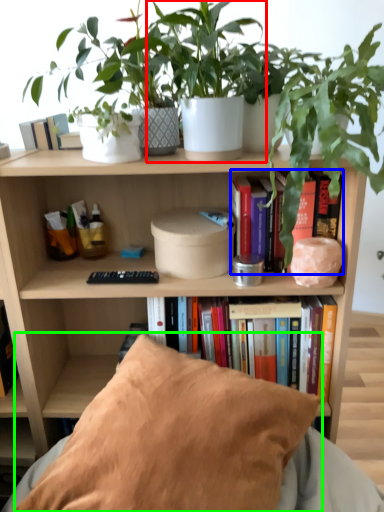
Question: Based on their relative distances, which object is nearer to houseplant (highlighted by a red box)? Choose from book (highlighted by a blue box) and pillow (highlighted by a green box).

Choices:
 (A) book
 (B) pillow

Answer: (A)